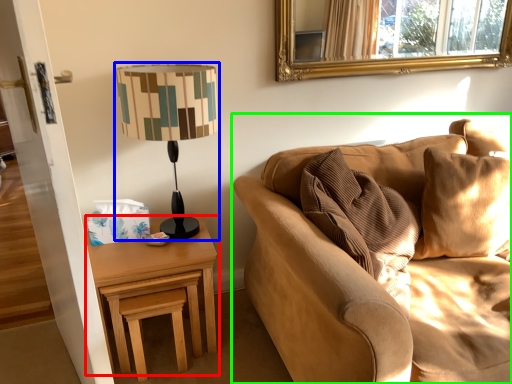
Question: Considering the real-world distances, which object is closest to nightstand (highlighted by a red box)? lamp (highlighted by a blue box) or studio couch (highlighted by a green box).

Choices:
 (A) lamp
 (B) studio couch

Answer: (B)